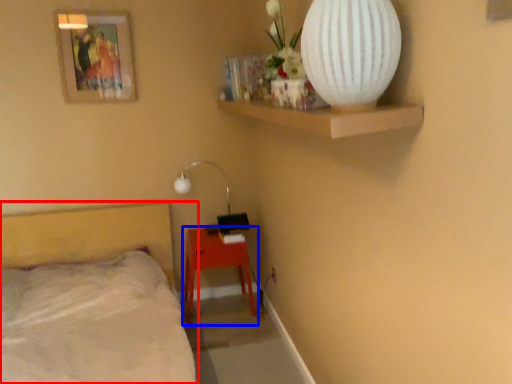
Question: Which of the following is the farthest to the observer, bed (highlighted by a red box) or nightstand (highlighted by a blue box)?

Choices:
 (A) bed
 (B) nightstand

Answer: (B)